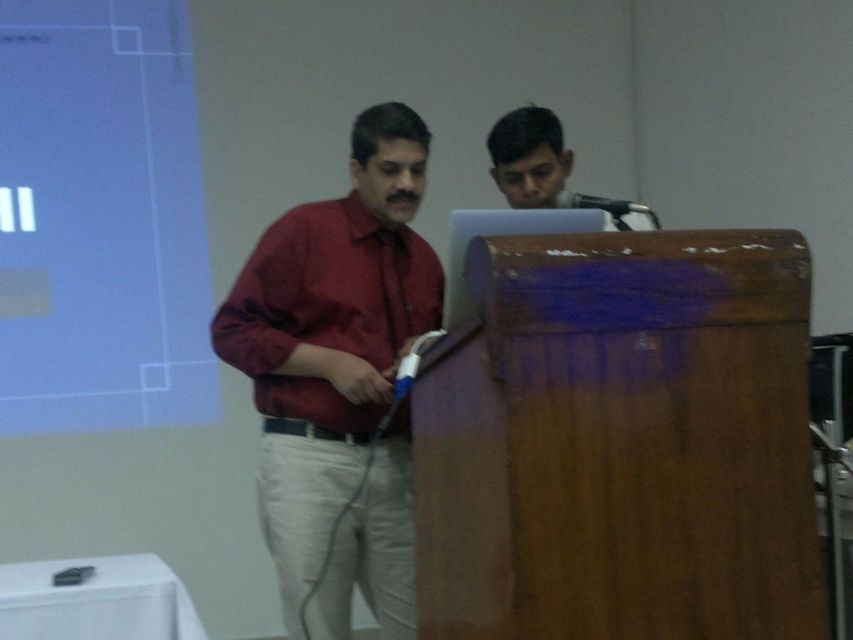
You are setting up for a presentation and need to position a projector. The projector requires a clear line of sight to the white matte projection screen at upper left. Given that the screen is at coordinates point 0.344, 0.118, where should you place the projector to ensure it can project onto the screen without obstruction?

The white matte projection screen at upper left is located at point (100,220), so you should place the projector in a position that allows a clear line of sight to this coordinate, ensuring no objects like the podium or people block the path.

You are an attendee at the presentation. You notice the white matte projection screen at upper left and the maroon shirt at center. Which object is closer to you?

The white matte projection screen at upper left is closer to you because it is further to the viewer than the maroon shirt at center.